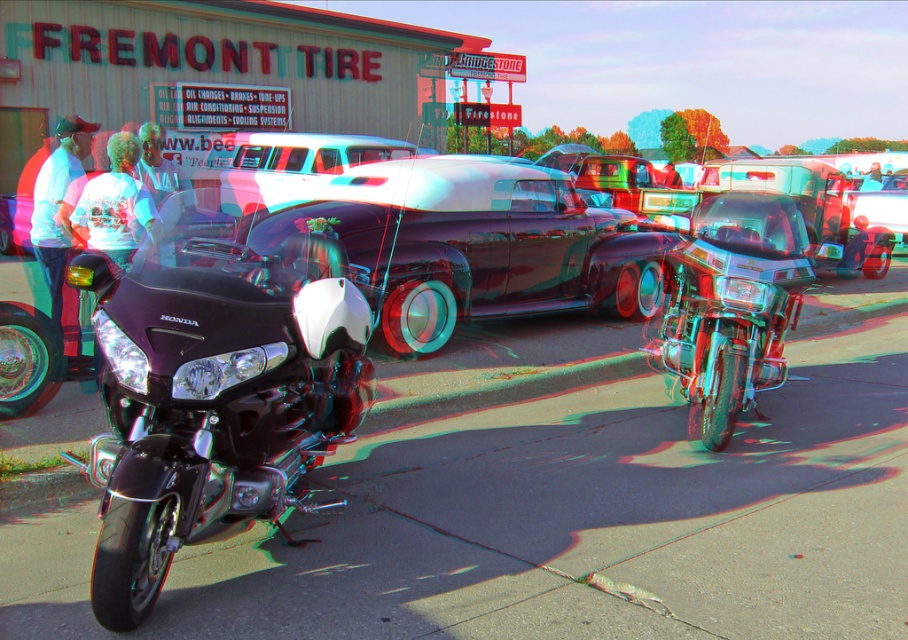
Question: Which object is closer to the camera taking this photo?

Choices:
 (A) white glossy limousine at center
 (B) shiny chrome motorcycle at center

Answer: (B)

Question: Does white glossy limousine at center appear on the left side of white cotton shirt at center?

Choices:
 (A) yes
 (B) no

Answer: (B)

Question: Does glossy black car at center appear on the left side of light blue t-shirt at left?

Choices:
 (A) yes
 (B) no

Answer: (B)

Question: Considering the real-world distances, which object is closest to the glossy black car at center?

Choices:
 (A) white glossy limousine at center
 (B) shiny chrome car at center

Answer: (A)

Question: Can you confirm if light blue t-shirt at left is positioned to the left of shiny chrome car at center?

Choices:
 (A) no
 (B) yes

Answer: (B)

Question: Among these objects, which one is nearest to the camera?

Choices:
 (A) white t-shirt at center
 (B) white glossy limousine at center
 (C) white cotton shirt at center

Answer: (A)